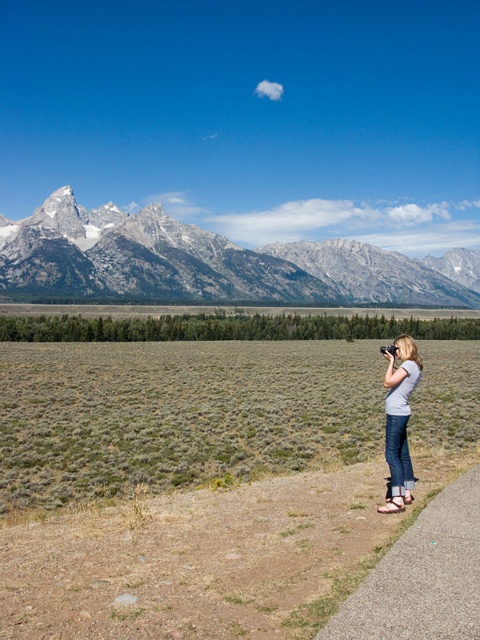
You are standing on the dirt path and want to walk to both the point at coordinates (x=257, y=268) and the point at coordinates (x=400, y=355). Which point should you reach first?

You should reach the point at coordinates (x=257, y=268) first because it is closer to you than the point at coordinates (x=400, y=355).

You are standing on the dirt path and want to take a photo of both the white rocky mountain range at upper left and the gray cotton shirt at right. Which object should you focus on first to ensure both are in the frame?

You should focus on the gray cotton shirt at right first because the white rocky mountain range at upper left is further away from you than the gray cotton shirt at right, so adjusting focus starting from the closer object ensures both are in the frame.

You are standing on the dirt path and want to take a photo that includes both the white rocky mountain range at upper left and the gray cotton shirt at right. According to the scene, which object should you position to the right side of your camera frame?

The gray cotton shirt at right should be positioned to the right side of your camera frame because the white rocky mountain range at upper left is to the right of the gray cotton shirt at right, meaning the mountain range is already positioned to the right of the shirt in the scene.